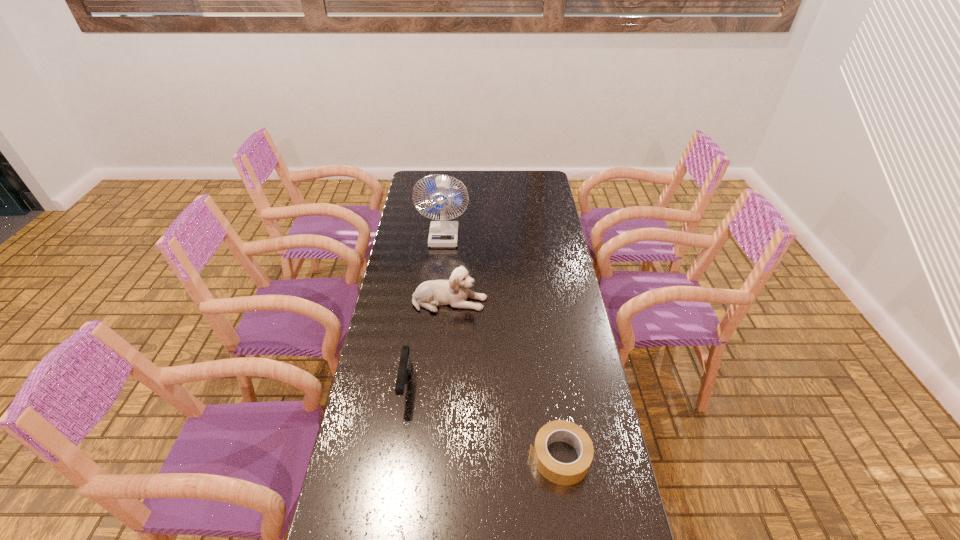
Where is `the farthest object`? The image size is (960, 540). the farthest object is located at coordinates (443, 233).

Where is `fan`? Image resolution: width=960 pixels, height=540 pixels. fan is located at coordinates (443, 233).

What are the coordinates of `puppy` in the screenshot? It's located at (454, 292).

You are a GUI agent. You are given a task and a screenshot of the screen. Output one action in this format:
    pyautogui.click(x=<x>, y=<y>)
    Task: Click on the third shortest object
    
    Given the screenshot: What is the action you would take?
    pyautogui.click(x=454, y=292)

What are the coordinates of `pistol` in the screenshot? It's located at (405, 366).

Image resolution: width=960 pixels, height=540 pixels. Identify the location of the second nearest object. (405, 366).

Locate an element on the screen. This screenshot has width=960, height=540. duct tape is located at coordinates (556, 472).

The width and height of the screenshot is (960, 540). Find the location of `the rightmost object`. the rightmost object is located at coordinates (x=556, y=472).

Image resolution: width=960 pixels, height=540 pixels. In order to click on blank space located 0.130m on the front-facing side of the fan in this screenshot , I will do (441, 268).

Locate an element on the screen. vacant region located 0.290m on the front-facing side of the third nearest object is located at coordinates (565, 301).